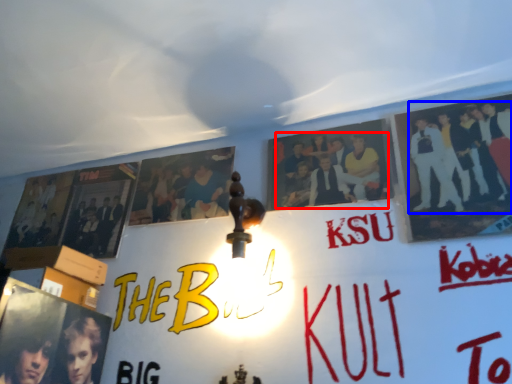
Question: Which point is closer to the camera, person (highlighted by a red box) or person (highlighted by a blue box)?

Choices:
 (A) person
 (B) person

Answer: (B)